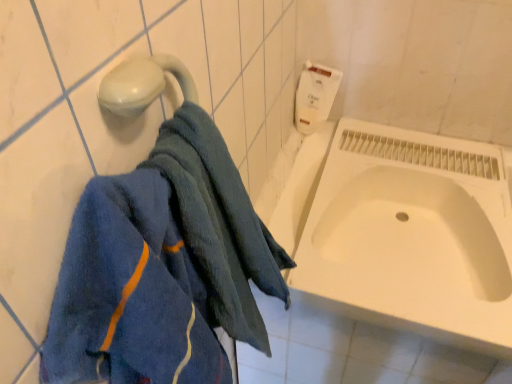
Question: Does white matte toilet paper at upper right come behind blue soft towel at left?

Choices:
 (A) no
 (B) yes

Answer: (B)

Question: Does white matte toilet paper at upper right turn towards blue soft towel at left?

Choices:
 (A) no
 (B) yes

Answer: (B)

Question: Does white matte toilet paper at upper right appear on the left side of blue soft towel at left?

Choices:
 (A) yes
 (B) no

Answer: (B)

Question: Is white matte toilet paper at upper right taller than blue soft towel at left?

Choices:
 (A) no
 (B) yes

Answer: (A)

Question: Can you confirm if white matte toilet paper at upper right is shorter than blue soft towel at left?

Choices:
 (A) no
 (B) yes

Answer: (B)

Question: From the image's perspective, is blue soft towel at left located above or below white glossy bathtub at center?

Choices:
 (A) below
 (B) above

Answer: (A)

Question: Considering the positions of blue soft towel at left and white glossy bathtub at center in the image, is blue soft towel at left wider or thinner than white glossy bathtub at center?

Choices:
 (A) wide
 (B) thin

Answer: (B)

Question: In terms of size, does blue soft towel at left appear bigger or smaller than white glossy bathtub at center?

Choices:
 (A) small
 (B) big

Answer: (A)

Question: Based on their positions, is blue soft towel at left located to the left or right of white glossy bathtub at center?

Choices:
 (A) right
 (B) left

Answer: (B)

Question: Is white glossy bathtub at center inside the boundaries of blue soft towel at left, or outside?

Choices:
 (A) inside
 (B) outside

Answer: (B)

Question: From the image's perspective, relative to blue soft towel at left, is white glossy bathtub at center above or below?

Choices:
 (A) above
 (B) below

Answer: (A)

Question: Considering the positions of white glossy bathtub at center and blue soft towel at left in the image, is white glossy bathtub at center wider or thinner than blue soft towel at left?

Choices:
 (A) thin
 (B) wide

Answer: (B)

Question: In terms of height, does white glossy bathtub at center look taller or shorter compared to blue soft towel at left?

Choices:
 (A) short
 (B) tall

Answer: (A)

Question: From their relative heights in the image, would you say white matte toilet paper at upper right is taller or shorter than white glossy bathtub at center?

Choices:
 (A) tall
 (B) short

Answer: (A)

Question: Considering the positions of white matte toilet paper at upper right and white glossy bathtub at center in the image, is white matte toilet paper at upper right wider or thinner than white glossy bathtub at center?

Choices:
 (A) wide
 (B) thin

Answer: (B)